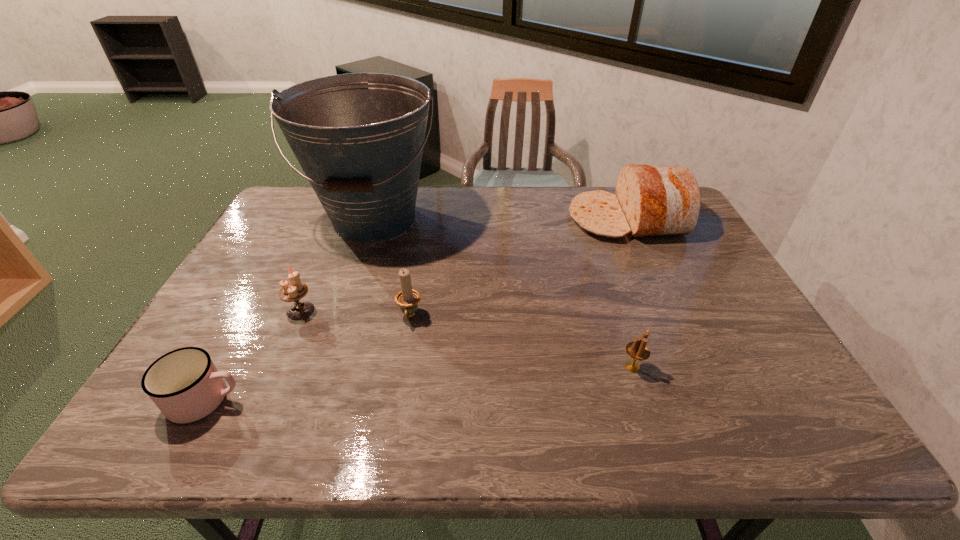
Locate an element on the screen. This screenshot has height=540, width=960. vacant region located 0.200m on the handle side of the second candle holder from right to left is located at coordinates click(x=396, y=395).

Find the location of `free space located on the right of the leftmost candle holder`. free space located on the right of the leftmost candle holder is located at coordinates [458, 310].

I want to click on vacant space located 0.230m on the left of the nearest candle holder, so click(x=524, y=367).

Identify the location of blank area located 0.210m on the side of the mug with the handle. Image resolution: width=960 pixels, height=540 pixels. (338, 400).

At what (x,y) coordinates should I click in order to perform the action: click on bucket present at the far edge. Please return your answer as a coordinate pair (x, y). This screenshot has width=960, height=540. Looking at the image, I should click on (359, 137).

Locate an element on the screen. The height and width of the screenshot is (540, 960). bread located at the far edge is located at coordinates (651, 200).

I want to click on object that is at the near edge, so click(185, 385).

Locate an element on the screen. The height and width of the screenshot is (540, 960). bucket that is at the left edge is located at coordinates (359, 137).

In order to click on mug that is at the left edge in this screenshot , I will do `click(185, 385)`.

The height and width of the screenshot is (540, 960). I want to click on object at the right edge, so click(x=651, y=200).